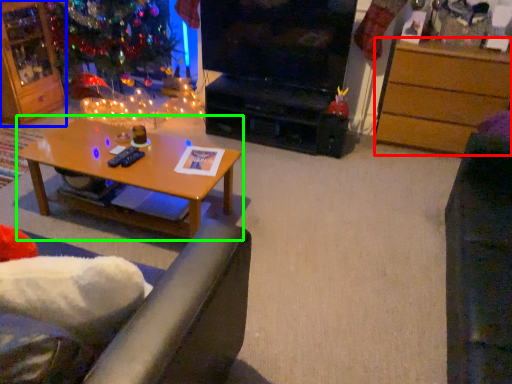
Question: Which object is the farthest from desk (highlighted by a red box)? Choose among these: cabinetry (highlighted by a blue box) or coffee table (highlighted by a green box).

Choices:
 (A) cabinetry
 (B) coffee table

Answer: (A)